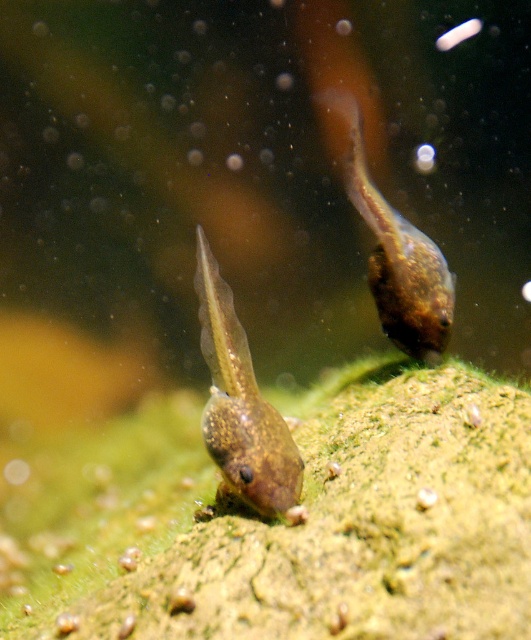
You are observing two points in the image of the tadpoles. Which point, point [208,333] or point [439,314], is nearer to you?

Point [208,333] is closer to the viewer than point [439,314].

Looking at this image, you are an aquatic robot observing the scene. You need to locate the translucent gelatinous tadpole at center. What are its coordinates?

The coordinates of the translucent gelatinous tadpole at center are at point (241, 404).